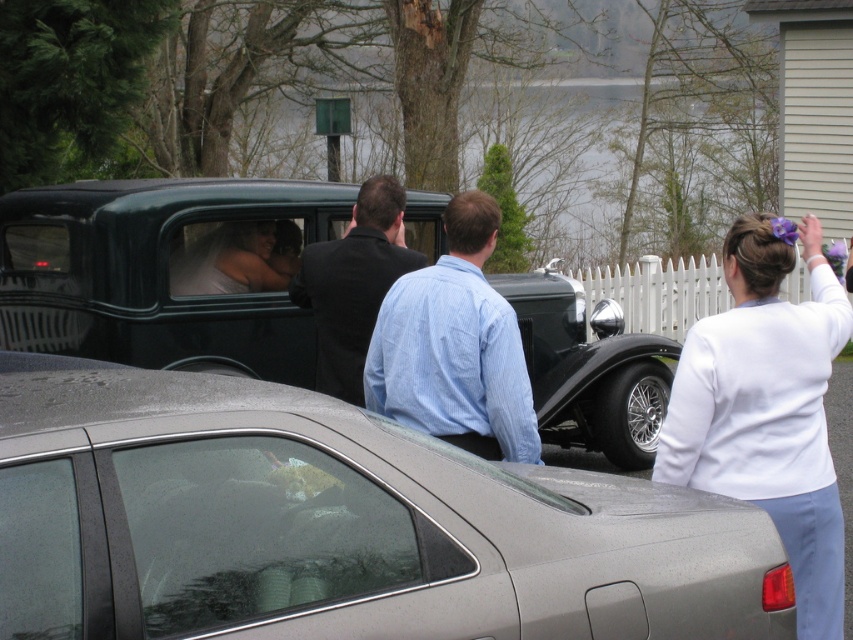
Question: Estimate the real-world distances between objects in this image. Which object is farther from the satin silver car at center?

Choices:
 (A) shiny black car at center
 (B) dark suit at center

Answer: (A)

Question: Which is farther from the satin silver car at center?

Choices:
 (A) white fabric at upper right
 (B) shiny black car at center
 (C) dark suit at center
 (D) blue striped shirt at center

Answer: (B)

Question: Which point is farther from the camera taking this photo?

Choices:
 (A) (141, 528)
 (B) (263, 289)
 (C) (403, 362)
 (D) (753, 253)

Answer: (B)

Question: Does blue striped shirt at center have a greater width compared to dark suit at center?

Choices:
 (A) no
 (B) yes

Answer: (A)

Question: Can you confirm if white fabric at upper right is bigger than blue striped shirt at center?

Choices:
 (A) no
 (B) yes

Answer: (B)

Question: Observing the image, what is the correct spatial positioning of white fabric at upper right in reference to dark suit at center?

Choices:
 (A) left
 (B) right

Answer: (B)